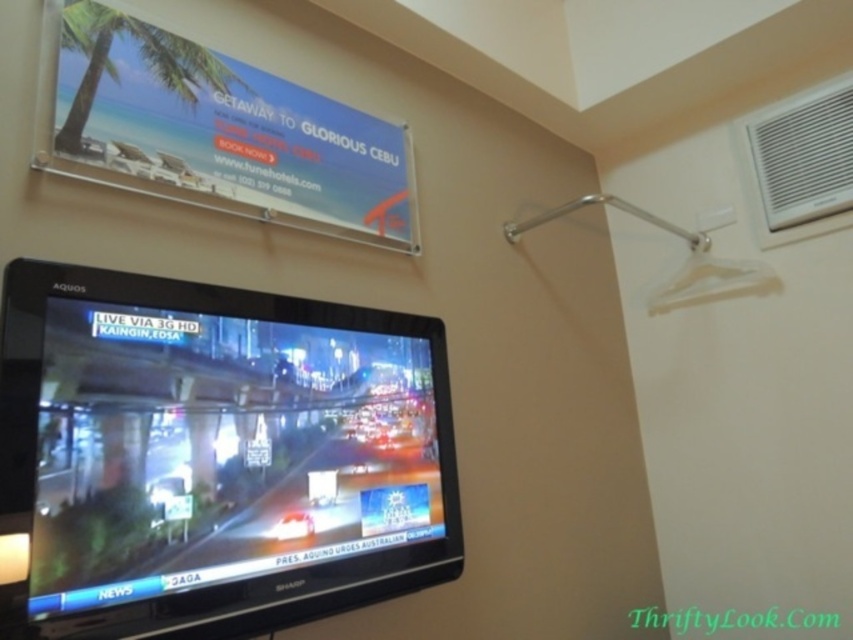
Who is more distant from viewer, [164,499] or [651,301]?

Positioned behind is point [651,301].

Is point (328, 365) farther from camera compared to point (722, 268)?

No, it is in front of (722, 268).

The height and width of the screenshot is (640, 853). I want to click on black glossy tv at center, so click(x=213, y=456).